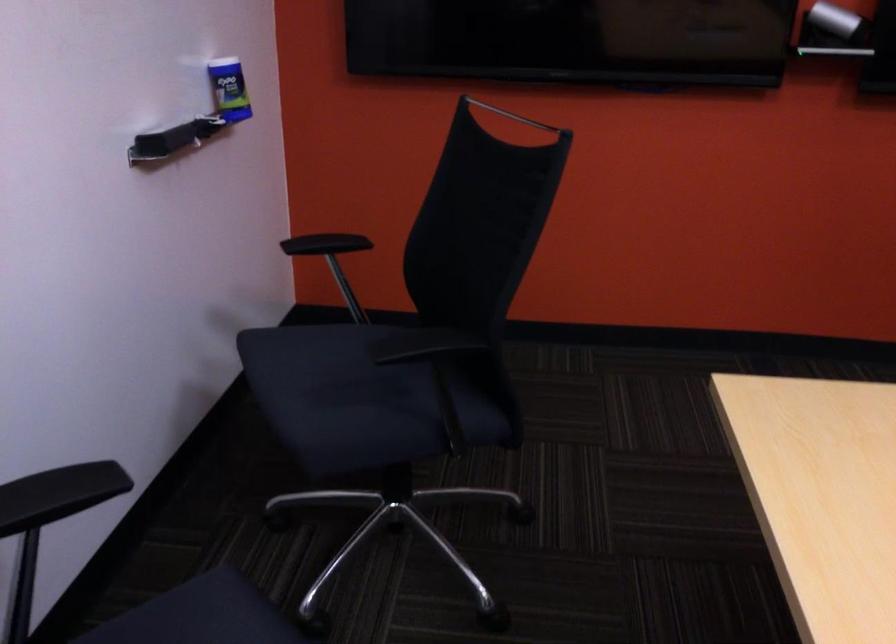
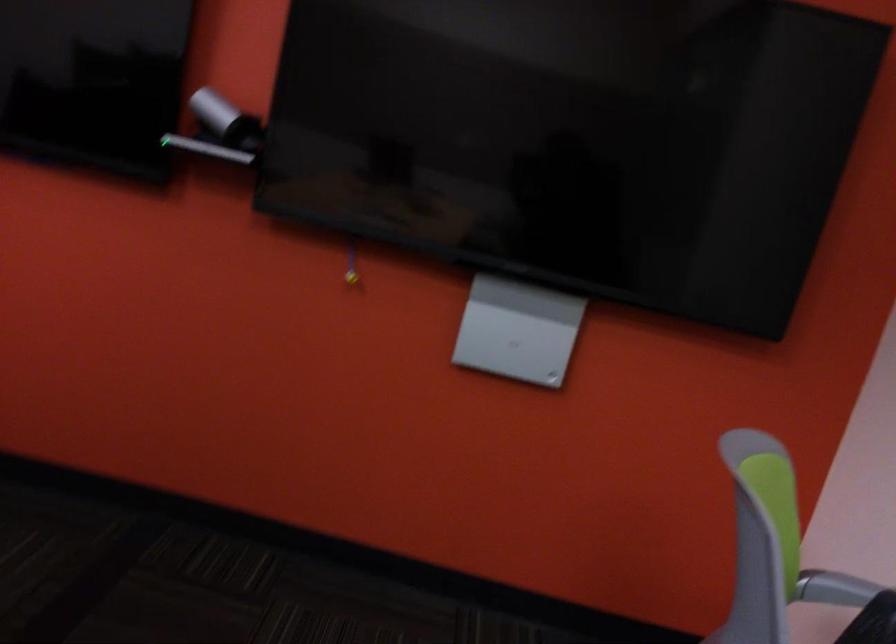
Question: Which direction would the cameraman need to move to produce the second image? Reply with the corresponding letter.

Choices:
 (A) Left
 (B) Right
 (C) Forward
 (D) Backward

Answer: (B)